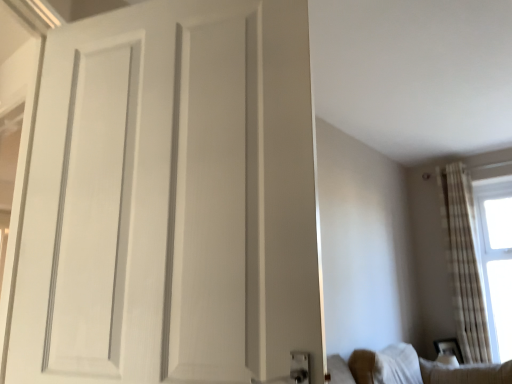
Question: Can you confirm if white sheer curtains at right is positioned to the right of white fabric couch at lower right?

Choices:
 (A) no
 (B) yes

Answer: (B)

Question: Is white sheer curtains at right positioned behind white fabric couch at lower right?

Choices:
 (A) no
 (B) yes

Answer: (B)

Question: Is white sheer curtains at right in contact with white fabric couch at lower right?

Choices:
 (A) yes
 (B) no

Answer: (B)

Question: From a real-world perspective, is white sheer curtains at right over white fabric couch at lower right?

Choices:
 (A) no
 (B) yes

Answer: (B)

Question: Does white sheer curtains at right appear on the left side of white fabric couch at lower right?

Choices:
 (A) yes
 (B) no

Answer: (B)

Question: From the image's perspective, is white sheer curtains at right on white fabric couch at lower right?

Choices:
 (A) no
 (B) yes

Answer: (B)

Question: Considering the relative sizes of white fabric couch at lower right and white sheer curtains at right in the image provided, is white fabric couch at lower right taller than white sheer curtains at right?

Choices:
 (A) yes
 (B) no

Answer: (B)

Question: Is white fabric couch at lower right closer to the viewer compared to white sheer curtains at right?

Choices:
 (A) yes
 (B) no

Answer: (A)

Question: Is white fabric couch at lower right facing away from white sheer curtains at right?

Choices:
 (A) no
 (B) yes

Answer: (A)

Question: Is white fabric couch at lower right not close to white sheer curtains at right?

Choices:
 (A) no
 (B) yes

Answer: (B)

Question: Does white fabric couch at lower right have a lesser height compared to white sheer curtains at right?

Choices:
 (A) no
 (B) yes

Answer: (B)

Question: Is white fabric couch at lower right smaller than white sheer curtains at right?

Choices:
 (A) yes
 (B) no

Answer: (A)

Question: From the image's perspective, is white matte door at center located above white fabric couch at lower right?

Choices:
 (A) yes
 (B) no

Answer: (A)